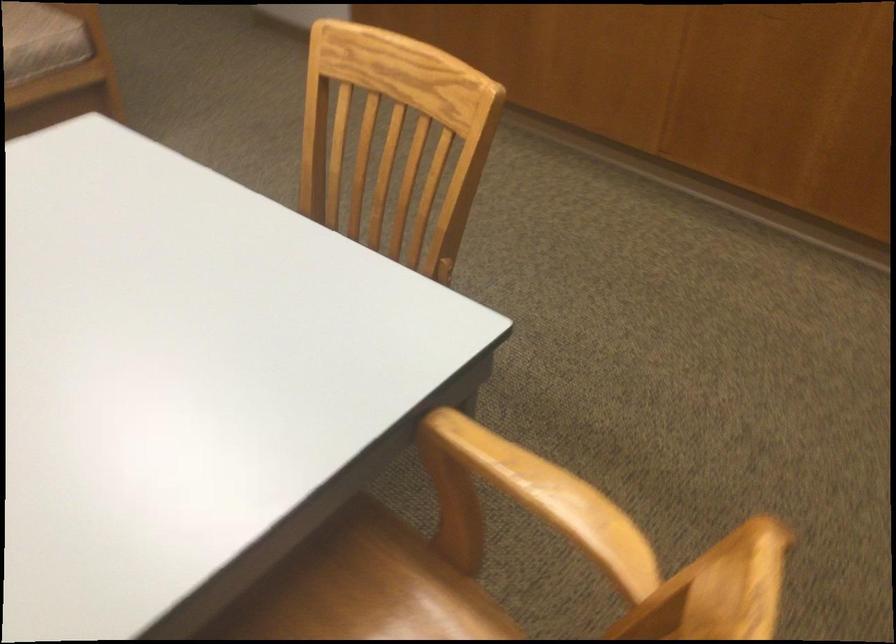
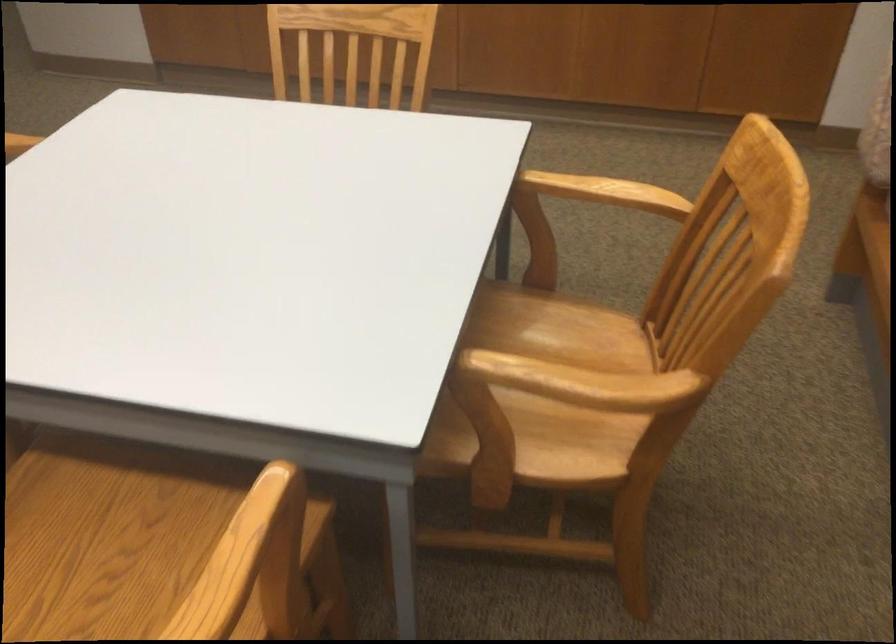
Locate, in the second image, the point that corresponds to pixel 540 482 in the first image.

(605, 192)